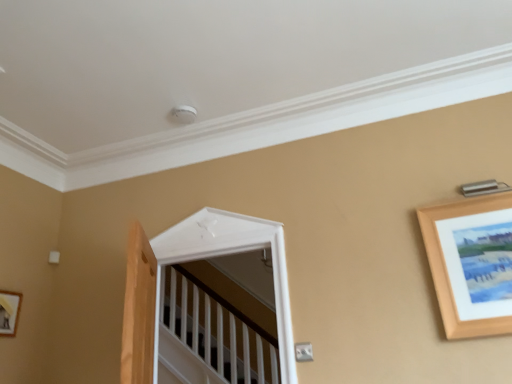
Question: Does white glossy door at center have a lesser height compared to wooden picture frame at lower left, acting as the 1th picture frame starting from the left?

Choices:
 (A) yes
 (B) no

Answer: (B)

Question: Can you confirm if white glossy door at center is smaller than wooden picture frame at lower left, acting as the 1th picture frame starting from the left?

Choices:
 (A) no
 (B) yes

Answer: (A)

Question: Does white glossy door at center appear on the left side of wooden picture frame at lower left, which is the first picture frame in back-to-front order?

Choices:
 (A) no
 (B) yes

Answer: (A)

Question: Would you say white glossy door at center is outside wooden picture frame at lower left, which is the first picture frame in back-to-front order?

Choices:
 (A) yes
 (B) no

Answer: (A)

Question: From the image's perspective, is white glossy door at center beneath wooden picture frame at lower left, which appears as the 2th picture frame when viewed from the right?

Choices:
 (A) no
 (B) yes

Answer: (A)

Question: From the image's perspective, is white glossy door at center located above or below wooden picture frame at lower left, which appears as the 2th picture frame when viewed from the right?

Choices:
 (A) below
 (B) above

Answer: (B)

Question: Considering their positions, is white glossy door at center located in front of or behind wooden picture frame at lower left, positioned as the 2th picture frame in front-to-back order?

Choices:
 (A) front
 (B) behind

Answer: (A)

Question: Does point (176, 225) appear closer or farther from the camera than point (14, 311)?

Choices:
 (A) closer
 (B) farther

Answer: (B)

Question: From a real-world perspective, is white glossy door at center positioned above or below wooden picture frame at lower left, which appears as the 2th picture frame when viewed from the right?

Choices:
 (A) above
 (B) below

Answer: (A)

Question: In terms of size, does wooden picture frame at upper right, the first picture frame in the front-to-back sequence, appear bigger or smaller than wooden picture frame at lower left, positioned as the 2th picture frame in front-to-back order?

Choices:
 (A) big
 (B) small

Answer: (A)

Question: Based on their positions, is wooden picture frame at upper right, marked as the second picture frame in a back-to-front arrangement, located to the left or right of wooden picture frame at lower left, which is the first picture frame in back-to-front order?

Choices:
 (A) right
 (B) left

Answer: (A)

Question: Which is correct: wooden picture frame at upper right, the first picture frame in the front-to-back sequence, is inside wooden picture frame at lower left, which is the first picture frame in back-to-front order, or outside of it?

Choices:
 (A) outside
 (B) inside

Answer: (A)

Question: Considering their positions, is wooden picture frame at upper right, the first picture frame in the front-to-back sequence, located in front of or behind wooden picture frame at lower left, which is the first picture frame in back-to-front order?

Choices:
 (A) behind
 (B) front

Answer: (B)

Question: From the image's perspective, is wooden picture frame at lower left, which is the first picture frame in back-to-front order, positioned above or below wooden picture frame at upper right, the first picture frame in the front-to-back sequence?

Choices:
 (A) above
 (B) below

Answer: (B)

Question: Is wooden picture frame at lower left, which is the first picture frame in back-to-front order, taller or shorter than wooden picture frame at upper right, arranged as the first picture frame when viewed from the right?

Choices:
 (A) short
 (B) tall

Answer: (A)